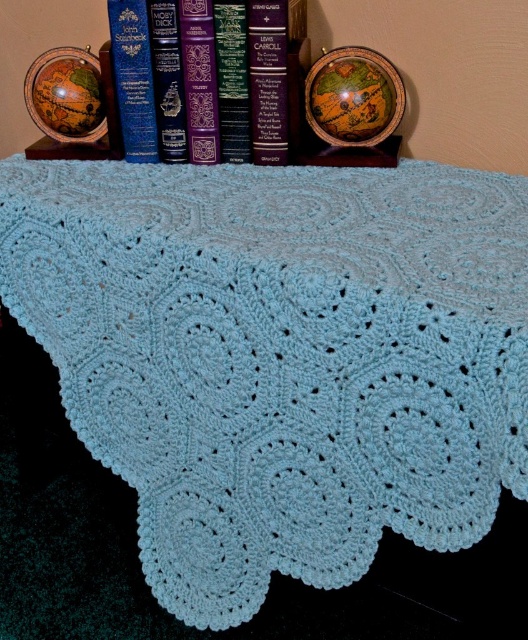
Question: Can you confirm if purple leather book at center is smaller than hardcover book at center?

Choices:
 (A) yes
 (B) no

Answer: (B)

Question: Observing the image, what is the correct spatial positioning of purple leather book at center in reference to hardcover book at center?

Choices:
 (A) right
 (B) left

Answer: (B)

Question: Among these objects, which one is nearest to the camera?

Choices:
 (A) purple leather book at center
 (B) hardcover book at center

Answer: (B)

Question: Does purple leather book at center appear on the right side of hardcover book at center?

Choices:
 (A) no
 (B) yes

Answer: (A)

Question: Which point is closer to the camera?

Choices:
 (A) hardcover book at center
 (B) purple leather book at center

Answer: (A)